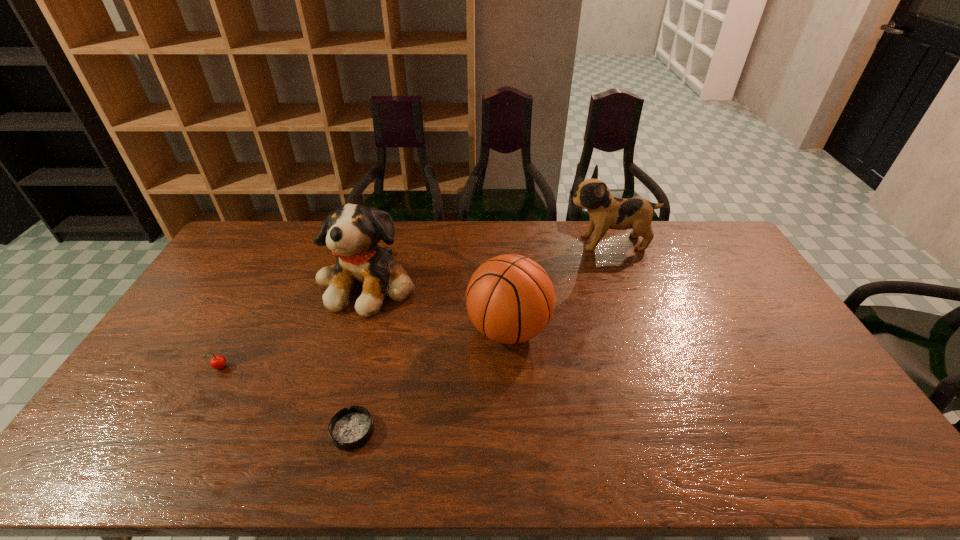
Locate an element on the screen. Image resolution: width=960 pixels, height=540 pixels. blank space at the far right corner of the desktop is located at coordinates (688, 239).

Where is `vacant space at the near right corner of the desktop`? This screenshot has width=960, height=540. vacant space at the near right corner of the desktop is located at coordinates (849, 452).

Image resolution: width=960 pixels, height=540 pixels. I want to click on free space between the basketball and the leftmost object, so click(364, 349).

Locate an element on the screen. free spot between the ashtray and the cherry is located at coordinates (286, 400).

You are a GUI agent. You are given a task and a screenshot of the screen. Output one action in this format:
    pyautogui.click(x=<x>, y=<y>)
    Task: Click on the free space between the rightmost object and the fourth object from left to right
    
    Given the screenshot: What is the action you would take?
    pyautogui.click(x=559, y=286)

The height and width of the screenshot is (540, 960). In order to click on free point between the left puppy and the shortest object in this screenshot , I will do [x=361, y=357].

Where is `empty space that is in between the ashtray and the left puppy`? empty space that is in between the ashtray and the left puppy is located at coordinates (361, 357).

Where is `empty space between the cherry and the left puppy`? Image resolution: width=960 pixels, height=540 pixels. empty space between the cherry and the left puppy is located at coordinates (295, 326).

This screenshot has width=960, height=540. I want to click on free spot between the fourth object from left to right and the left puppy, so click(x=439, y=306).

You are a GUI agent. You are given a task and a screenshot of the screen. Output one action in this format:
    pyautogui.click(x=<x>, y=<y>)
    Task: Click on the free spot between the basketball and the leftmost object
    The image size is (960, 540).
    Given the screenshot: What is the action you would take?
    pyautogui.click(x=364, y=349)